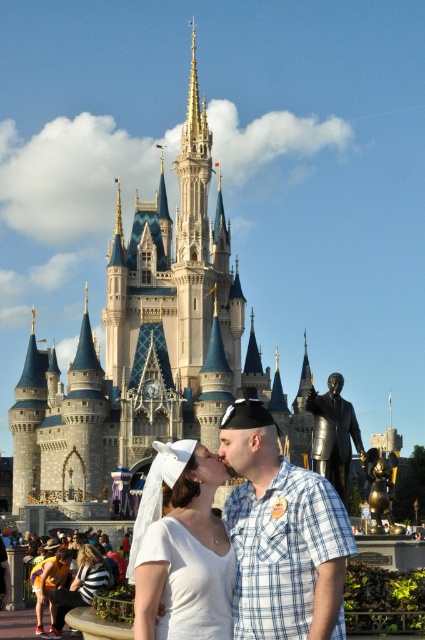
Can you confirm if blue plaid shirt at center is thinner than white satin veil at lower center?

No.

Can you confirm if blue plaid shirt at center is shorter than white satin veil at lower center?

Incorrect, blue plaid shirt at center's height does not fall short of white satin veil at lower center's.

Does point (257, 452) come farther from viewer compared to point (87, 548)?

No, (257, 452) is closer to viewer.

You are a GUI agent. You are given a task and a screenshot of the screen. Output one action in this format:
    pyautogui.click(x=<x>, y=<y>)
    Task: Click on the blue plaid shirt at center
    This screenshot has height=640, width=425.
    Given the screenshot: What is the action you would take?
    pyautogui.click(x=280, y=534)

Does point (200, 134) come farther from viewer compared to point (249, 525)?

Yes, point (200, 134) is behind point (249, 525).

This screenshot has height=640, width=425. I want to click on golden stone castle at upper center, so click(147, 352).

Between blue plaid shirt at center and shiny bronze statue at center, which one appears on the right side from the viewer's perspective?

From the viewer's perspective, shiny bronze statue at center appears more on the right side.

Is point (331, 634) farther from viewer compared to point (340, 412)?

No, (331, 634) is in front of (340, 412).

Is point (260, 637) behind point (357, 440)?

That is False.

The width and height of the screenshot is (425, 640). Find the location of `blue plaid shirt at center`. blue plaid shirt at center is located at coordinates (280, 534).